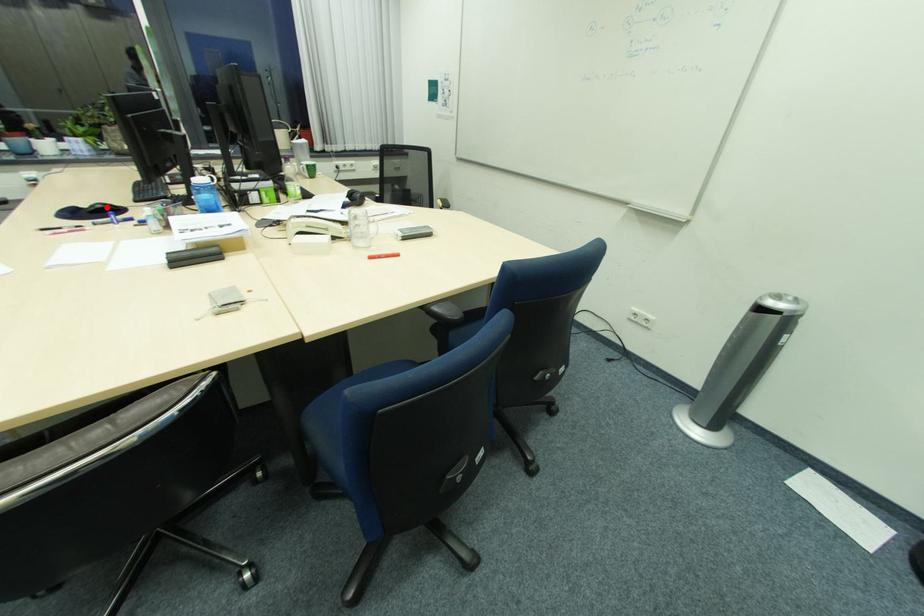
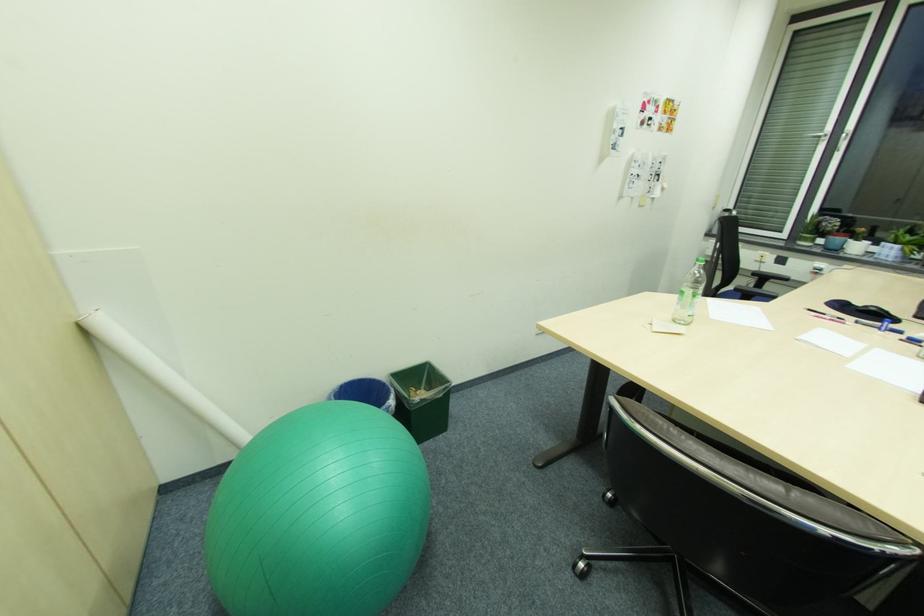
Question: I am providing you with two images of the same scene from different viewpoints. A red point is shown in image1. For the corresponding object point in image2, is it positioned nearer or farther from the camera?

Choices:
 (A) Nearer
 (B) Farther

Answer: (B)